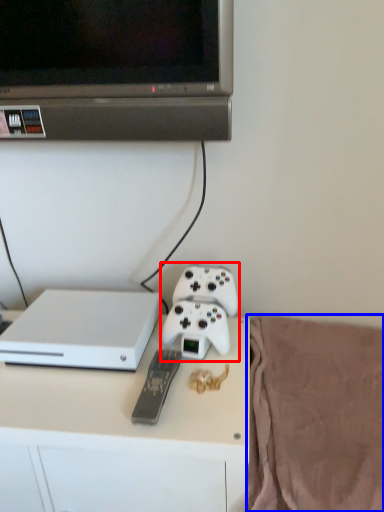
Question: Among these objects, which one is farthest to the camera, game controller (highlighted by a red box) or blanket (highlighted by a blue box)?

Choices:
 (A) game controller
 (B) blanket

Answer: (A)